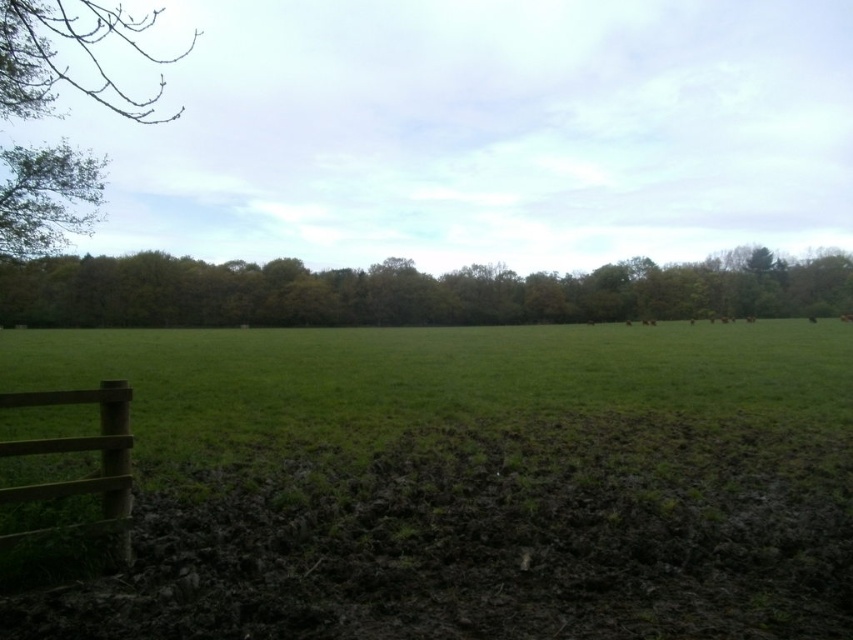
Question: Based on their relative distances, which object is farther from the brown wooden fence at lower left?

Choices:
 (A) green leafy tree at upper left
 (B) green leafy trees at upper center

Answer: (B)

Question: Is green leafy tree at upper left thinner than brown wooden fence at lower left?

Choices:
 (A) yes
 (B) no

Answer: (B)

Question: Can you confirm if green leafy trees at upper center is bigger than brown wooden fence at lower left?

Choices:
 (A) no
 (B) yes

Answer: (B)

Question: Which object appears closest to the camera in this image?

Choices:
 (A) brown wooden fence at lower left
 (B) green leafy trees at upper center

Answer: (A)

Question: Can you confirm if green leafy trees at upper center is bigger than brown wooden fence at lower left?

Choices:
 (A) yes
 (B) no

Answer: (A)

Question: Which point appears closest to the camera in this image?

Choices:
 (A) (86, 529)
 (B) (74, 198)
 (C) (463, 308)

Answer: (A)